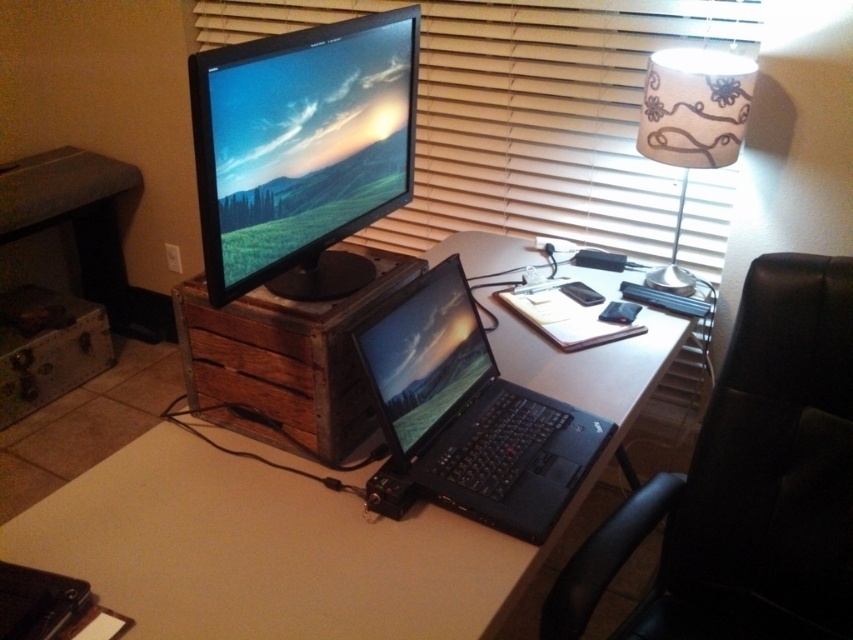
Is black glossy laptop at center below white fabric lampshade at upper right?

Correct, black glossy laptop at center is located below white fabric lampshade at upper right.

Can you confirm if black glossy laptop at center is taller than white fabric lampshade at upper right?

In fact, black glossy laptop at center may be shorter than white fabric lampshade at upper right.

Is point (432, 390) farther from camera compared to point (648, 58)?

No, (432, 390) is in front of (648, 58).

At what (x,y) coordinates should I click in order to perform the action: click on black glossy laptop at center. Please return your answer as a coordinate pair (x, y). Looking at the image, I should click on (x=424, y=355).

Is wooden blinds at upper center shorter than white fabric lampshade at upper right?

No.

Does wooden blinds at upper center lie behind white fabric lampshade at upper right?

Yes, wooden blinds at upper center is behind white fabric lampshade at upper right.

Does point (399, 244) come farther from viewer compared to point (675, 97)?

Yes, it is behind point (675, 97).

This screenshot has height=640, width=853. I want to click on wooden blinds at upper center, so click(x=525, y=109).

This screenshot has height=640, width=853. What do you see at coordinates (747, 483) in the screenshot?
I see `black leather swivel chair at right` at bounding box center [747, 483].

The height and width of the screenshot is (640, 853). Find the location of `black leather swivel chair at right`. black leather swivel chair at right is located at coordinates coord(747,483).

Where is `black leather swivel chair at right`? black leather swivel chair at right is located at coordinates (747, 483).